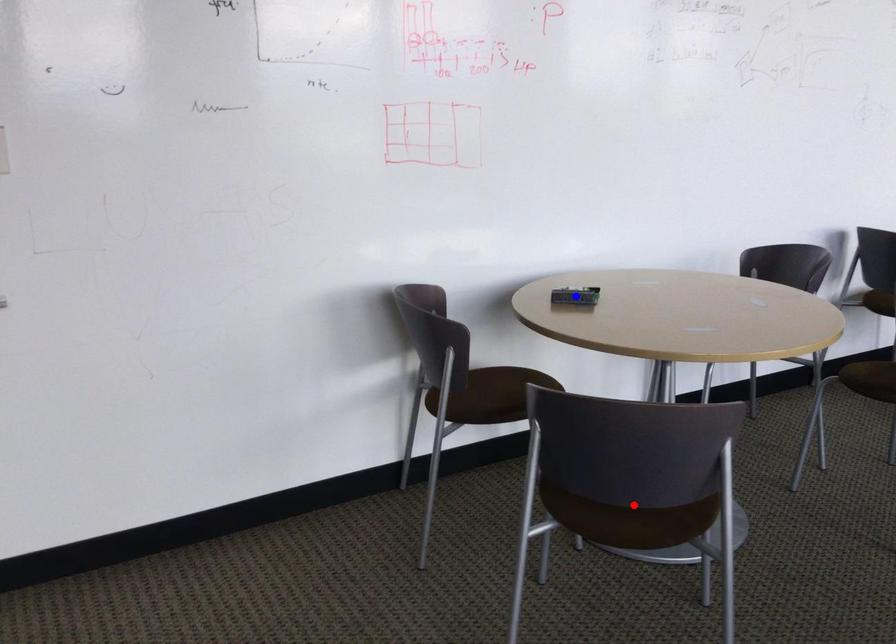
Question: In the image, two points are highlighted. Which point is nearer to the camera? Reply with the corresponding letter.

Choices:
 (A) blue point
 (B) red point

Answer: (B)